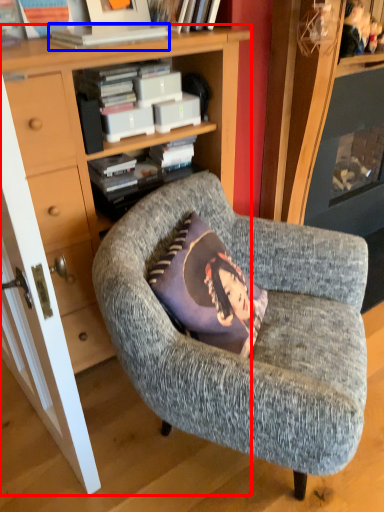
Question: Among these objects, which one is nearest to the camera, bookcase (highlighted by a red box) or book (highlighted by a blue box)?

Choices:
 (A) bookcase
 (B) book

Answer: (A)